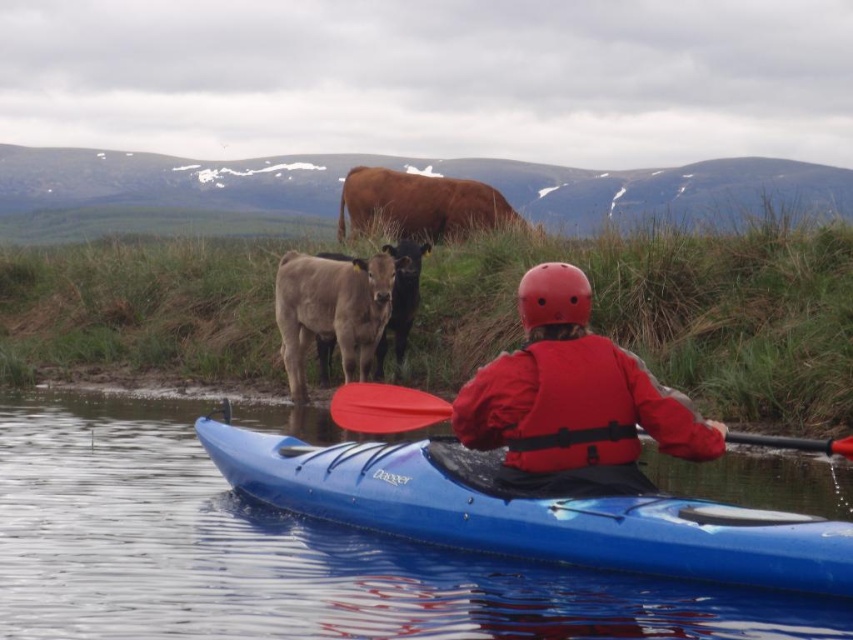
You are a photographer standing on the shore and want to take a photo of the blue plastic canoe at center and the red matte life jacket at center. Which object should you focus on first if you want to capture both clearly in the same frame?

The blue plastic canoe at center is in front of the red matte life jacket at center, so you should focus on the blue plastic canoe at center first to ensure both are in focus.

You are planning to store the blue plastic canoe at center and the smooth brown calf at center in a storage shed. The shed has a 1.5 meter height limit. Which object might not fit inside the shed?

The smooth brown calf at center might not fit inside the shed because the blue plastic canoe at center is shorter than it, and if the shed has a 1.5 meter height limit, the calf could exceed that height.